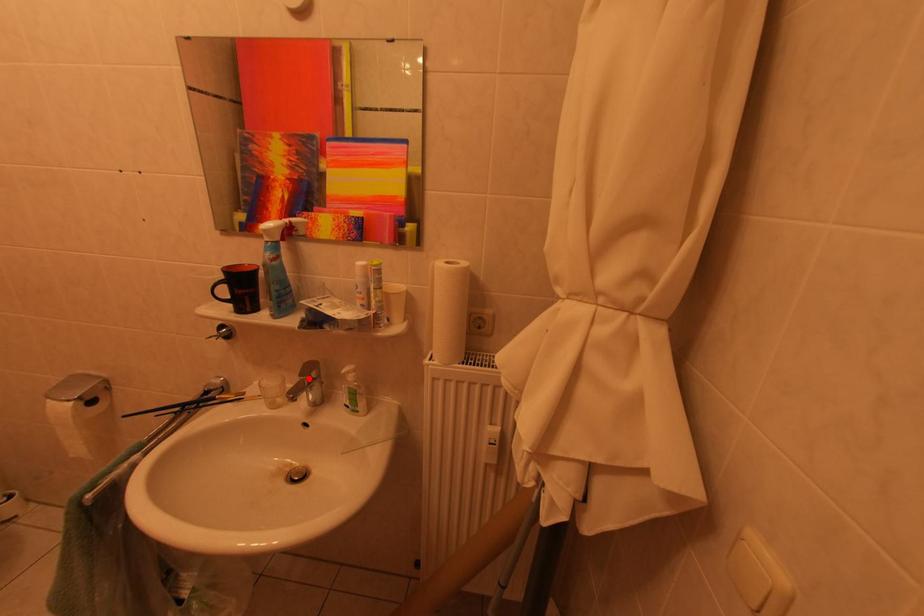
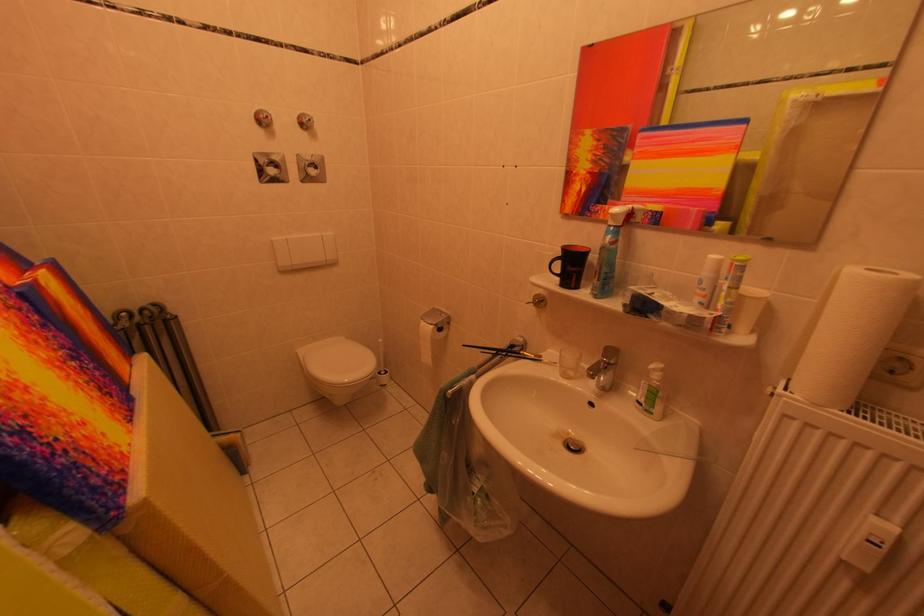
In the second image, find the point that corresponds to the highlighted location in the first image.

(612, 360)